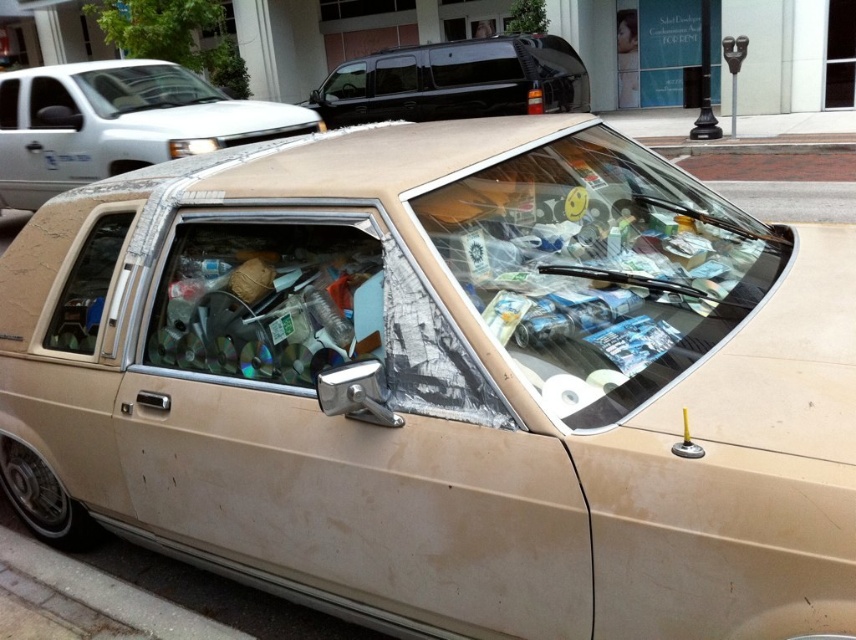
Question: Is transparent plastic windshield at center positioned at the back of beige matte car at center?

Choices:
 (A) no
 (B) yes

Answer: (A)

Question: Is the position of transparent plastic windshield at center less distant than that of black glossy minivan at upper center?

Choices:
 (A) no
 (B) yes

Answer: (B)

Question: Among these objects, which one is farthest from the camera?

Choices:
 (A) beige matte car at center
 (B) black glossy minivan at upper center

Answer: (B)

Question: Based on their relative distances, which object is farther from the black glossy minivan at upper center?

Choices:
 (A) beige matte car at center
 (B) transparent plastic windshield at center
 (C) concrete at lower left

Answer: (C)

Question: Among these objects, which one is nearest to the camera?

Choices:
 (A) concrete at lower left
 (B) transparent plastic windshield at center
 (C) black glossy minivan at upper center
 (D) beige matte car at center

Answer: (B)

Question: Does beige matte car at center appear over concrete at lower left?

Choices:
 (A) yes
 (B) no

Answer: (A)